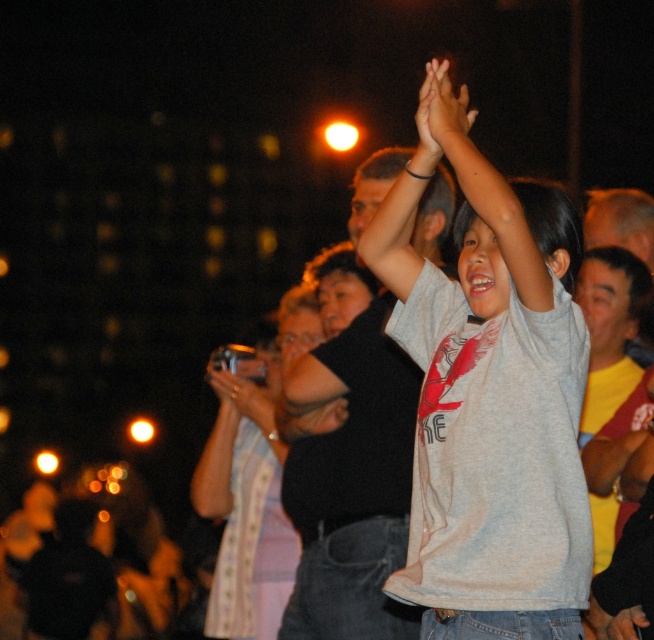
Who is lower down, gray matte shirt at center or metallic silver camera at center?

metallic silver camera at center is below.

Between point (436, 394) and point (216, 388), which one is positioned behind?

The point (216, 388) is behind.

Who is more distant from viewer, (466, 406) or (218, 385)?

The point (218, 385) is more distant.

Locate an element on the screen. gray matte shirt at center is located at coordinates (490, 410).

Locate an element on the screen. This screenshot has height=640, width=654. gray matte shirt at center is located at coordinates (490, 410).

Who is lower down, gray matte shirt at center or smooth skin hands at upper center?

gray matte shirt at center

Between point (506, 413) and point (475, 109), which one is positioned in front?

Point (506, 413) is more forward.

Image resolution: width=654 pixels, height=640 pixels. Identify the location of gray matte shirt at center. (490, 410).

Who is lower down, smooth skin hands at upper center or metallic silver camera at center?

metallic silver camera at center is lower down.

This screenshot has height=640, width=654. What do you see at coordinates (443, 116) in the screenshot?
I see `smooth skin hands at upper center` at bounding box center [443, 116].

What do you see at coordinates (443, 116) in the screenshot? The height and width of the screenshot is (640, 654). I see `smooth skin hands at upper center` at bounding box center [443, 116].

The width and height of the screenshot is (654, 640). I want to click on smooth skin hands at upper center, so [x=443, y=116].